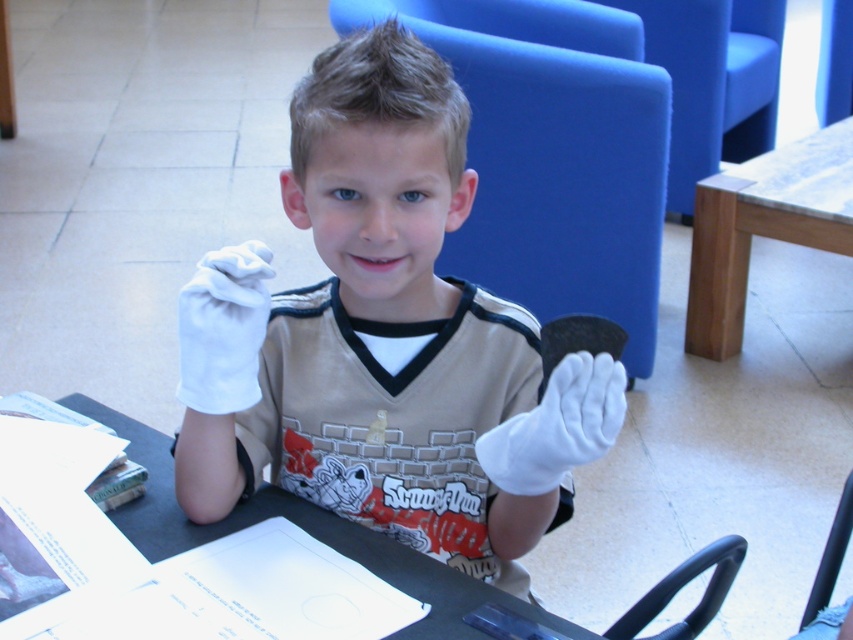
Question: Does blue fabric chair at center have a smaller size compared to black plastic chair at lower right?

Choices:
 (A) no
 (B) yes

Answer: (A)

Question: Is wooden at right positioned in front of black plastic chair at lower right?

Choices:
 (A) no
 (B) yes

Answer: (A)

Question: Which point is closer to the camera?

Choices:
 (A) (804, 614)
 (B) (151, 515)
 (C) (222, 371)
 (D) (746, 264)

Answer: (C)

Question: Which point appears farthest from the camera in this image?

Choices:
 (A) (555, 300)
 (B) (520, 506)
 (C) (659, 612)

Answer: (A)

Question: Does white cotton gloves at center lie behind blue fabric chair at center?

Choices:
 (A) yes
 (B) no

Answer: (B)

Question: Among these points, which one is nearest to the camera?

Choices:
 (A) (843, 186)
 (B) (248, 296)
 (C) (811, 616)

Answer: (B)